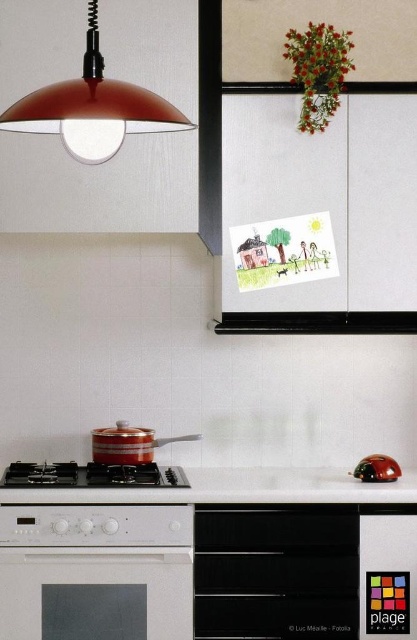
Does matte red lampshade at upper left have a greater width compared to white glossy countertop at lower center?

No.

Can you confirm if matte red lampshade at upper left is positioned above white glossy countertop at lower center?

Correct, matte red lampshade at upper left is located above white glossy countertop at lower center.

Where is `matte red lampshade at upper left`? The image size is (417, 640). matte red lampshade at upper left is located at coordinates (92, 108).

Which is more to the right, white glossy oven at lower left or matte red lampshade at upper left?

From the viewer's perspective, matte red lampshade at upper left appears more on the right side.

Between point (137, 609) and point (82, 129), which one is positioned behind?

The point (137, 609) is behind.

I want to click on white glossy oven at lower left, so click(x=95, y=593).

Looking at this image, does white glossy oven at lower left appear on the right side of metallic red ladybug at lower right?

In fact, white glossy oven at lower left is to the left of metallic red ladybug at lower right.

Can you confirm if white glossy oven at lower left is wider than metallic red ladybug at lower right?

Indeed, white glossy oven at lower left has a greater width compared to metallic red ladybug at lower right.

Where is `white glossy oven at lower left`? white glossy oven at lower left is located at coordinates (95, 593).